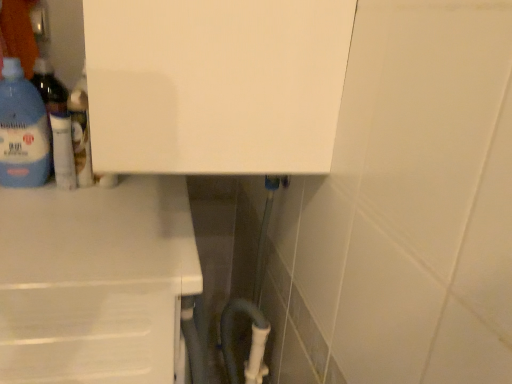
Locate an element on the screen. The height and width of the screenshot is (384, 512). vacant point to the right of white glossy lotion at upper left, marked as the 1th bottle in a right-to-left arrangement is located at coordinates (135, 189).